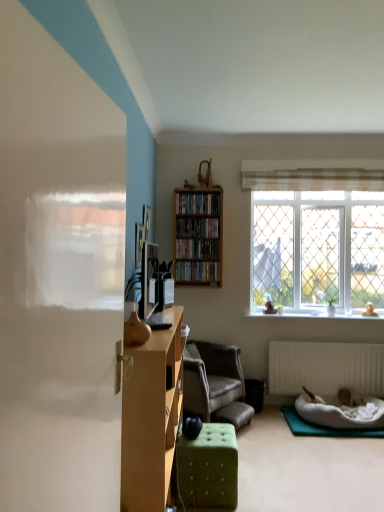
Question: Is clear glass window at upper right at the left side of matte brown vase at center?

Choices:
 (A) no
 (B) yes

Answer: (A)

Question: Is clear glass window at upper right positioned beyond the bounds of matte brown vase at center?

Choices:
 (A) yes
 (B) no

Answer: (A)

Question: Is clear glass window at upper right taller than matte brown vase at center?

Choices:
 (A) no
 (B) yes

Answer: (B)

Question: From a real-world perspective, is clear glass window at upper right on matte brown vase at center?

Choices:
 (A) no
 (B) yes

Answer: (B)

Question: Is clear glass window at upper right bigger than matte brown vase at center?

Choices:
 (A) no
 (B) yes

Answer: (B)

Question: Considering the positions of green fabric ottoman at lower center and wooden bookshelf at center, which is counted as the 2th book, starting from the bottom, in the image, is green fabric ottoman at lower center bigger or smaller than wooden bookshelf at center, which is counted as the 2th book, starting from the bottom,?

Choices:
 (A) big
 (B) small

Answer: (A)

Question: From the image's perspective, is green fabric ottoman at lower center positioned above or below wooden bookshelf at center, which is counted as the third book, starting from the top?

Choices:
 (A) below
 (B) above

Answer: (A)

Question: Visually, is green fabric ottoman at lower center positioned to the left or to the right of wooden bookshelf at center, which is counted as the 2th book, starting from the bottom?

Choices:
 (A) left
 (B) right

Answer: (B)

Question: Looking at their shapes, would you say green fabric ottoman at lower center is wider or thinner than wooden bookshelf at center, which is counted as the third book, starting from the top?

Choices:
 (A) thin
 (B) wide

Answer: (B)

Question: Considering their positions, is wooden shelf at center, the fourth book positioned from the bottom, located in front of or behind wooden bookshelf at center, which is counted as the third book, starting from the top?

Choices:
 (A) front
 (B) behind

Answer: (A)

Question: Considering the positions of wooden shelf at center, arranged as the first book when viewed from the top, and wooden bookshelf at center, which is counted as the 2th book, starting from the bottom, in the image, is wooden shelf at center, arranged as the first book when viewed from the top, wider or thinner than wooden bookshelf at center, which is counted as the 2th book, starting from the bottom,?

Choices:
 (A) thin
 (B) wide

Answer: (A)

Question: In terms of height, does wooden shelf at center, the fourth book positioned from the bottom, look taller or shorter compared to wooden bookshelf at center, which is counted as the third book, starting from the top?

Choices:
 (A) short
 (B) tall

Answer: (B)

Question: Based on their positions, is wooden shelf at center, the fourth book positioned from the bottom, located to the left or right of wooden bookshelf at center, which is counted as the 2th book, starting from the bottom?

Choices:
 (A) right
 (B) left

Answer: (A)

Question: Considering their positions, is green tufted ottoman at center located in front of or behind wooden shelf at center, the fourth book positioned from the bottom?

Choices:
 (A) front
 (B) behind

Answer: (A)

Question: From a real-world perspective, relative to wooden shelf at center, the fourth book positioned from the bottom, is green tufted ottoman at center vertically above or below?

Choices:
 (A) above
 (B) below

Answer: (B)